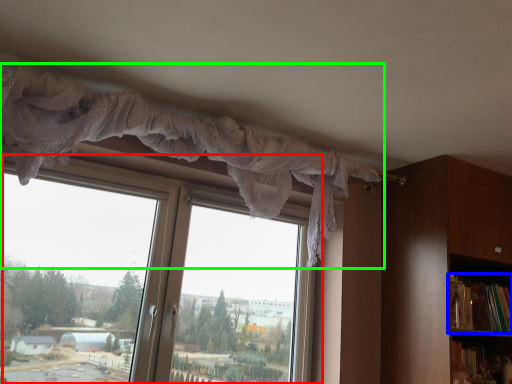
Question: Estimate the real-world distances between objects in this image. Which object is closer to window (highlighted by a red box), book (highlighted by a blue box) or curtain (highlighted by a green box)?

Choices:
 (A) book
 (B) curtain

Answer: (B)